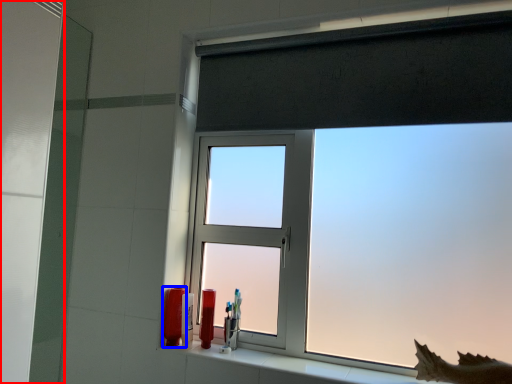
Question: Which point is further to the camera, screen door (highlighted by a red box) or toiletry (highlighted by a blue box)?

Choices:
 (A) screen door
 (B) toiletry

Answer: (B)